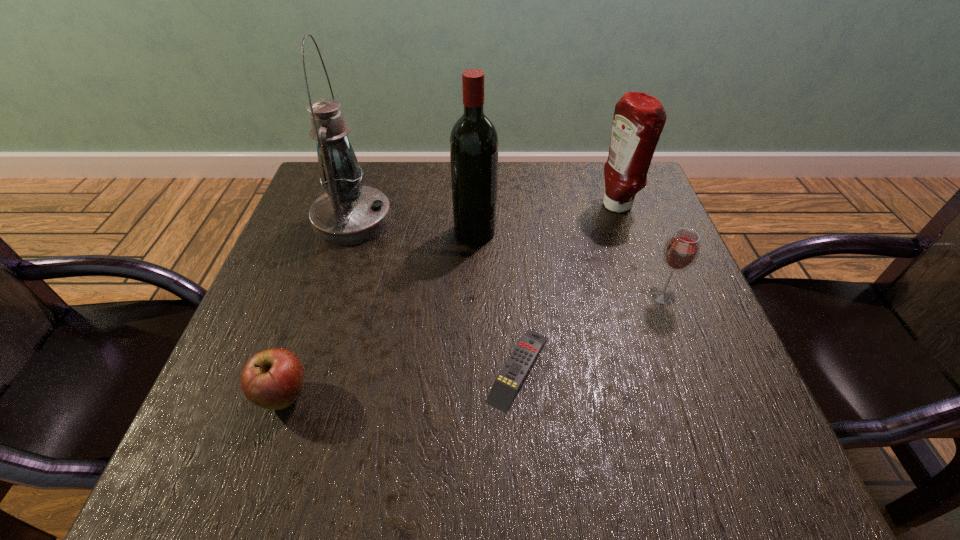
This screenshot has width=960, height=540. What are the coordinates of `oil lamp` in the screenshot? It's located at (349, 213).

Locate an element on the screen. The image size is (960, 540). wine bottle is located at coordinates (473, 140).

This screenshot has height=540, width=960. In order to click on condiment in this screenshot , I will do `click(639, 118)`.

Locate an element on the screen. The width and height of the screenshot is (960, 540). wineglass is located at coordinates (681, 251).

Find the location of `the third nearest object`. the third nearest object is located at coordinates (681, 251).

Find the location of a particular element. the second shortest object is located at coordinates click(x=272, y=379).

Identify the location of the shortest object. The image size is (960, 540). (505, 387).

I want to click on vacant space located on the right of the oil lamp, so click(507, 220).

I want to click on vacant point located on the label of the wine bottle, so click(x=652, y=232).

Find the location of `vacant area situated 0.190m on the left of the fourth shortest object`. vacant area situated 0.190m on the left of the fourth shortest object is located at coordinates (522, 206).